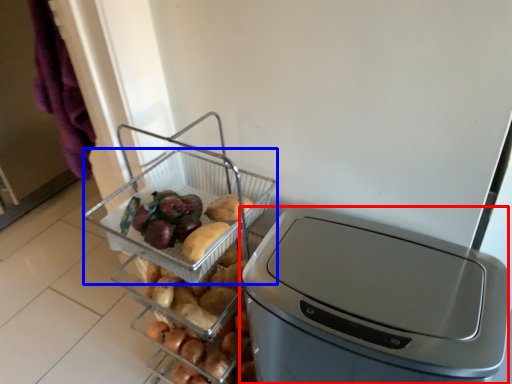
Question: Which object appears closest to the camera in this image, home appliance (highlighted by a red box) or basket (highlighted by a blue box)?

Choices:
 (A) home appliance
 (B) basket

Answer: (A)